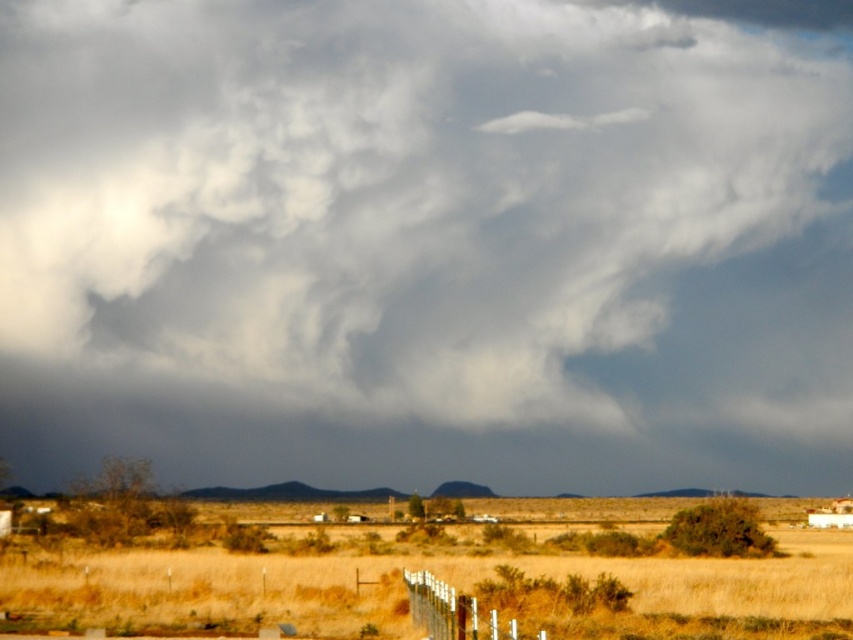
You are a hiker standing in the desert and see the dry grass at lower center and the white wooden fence at lower center. Which object is taller?

The dry grass at lower center is taller than the white wooden fence at lower center according to the description.

You are standing in the desert landscape and see the dry grass at lower center and the white wooden fence at lower center. Which object is located to the left when facing the fence?

The dry grass at lower center is positioned on the left side of the white wooden fence at lower center, so it is located to the left when facing the fence.

In the scene shown: You are a hiker trying to cross the dry grass at lower center and the white wooden fence at lower center. Which one would you encounter first if you walk straight ahead from your current position?

The dry grass at lower center is larger in size than the white wooden fence at lower center, so you would encounter the dry grass at lower center first since it occupies more space in the foreground.